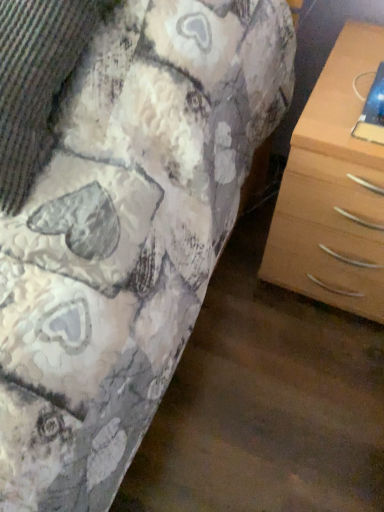
Describe the element at coordinates (333, 189) in the screenshot. I see `light brown wooden chest of drawers at right` at that location.

At what (x,y) coordinates should I click in order to perform the action: click on light brown wooden chest of drawers at right. Please return your answer as a coordinate pair (x, y). Image resolution: width=384 pixels, height=512 pixels. Looking at the image, I should click on (333, 189).

What is the approximate width of light brown wooden chest of drawers at right?

light brown wooden chest of drawers at right is 20.74 inches wide.

You are a GUI agent. You are given a task and a screenshot of the screen. Output one action in this format:
    pyautogui.click(x=<x>, y=<y>)
    Task: Click on the light brown wooden chest of drawers at right
    The width and height of the screenshot is (384, 512).
    Given the screenshot: What is the action you would take?
    pyautogui.click(x=333, y=189)